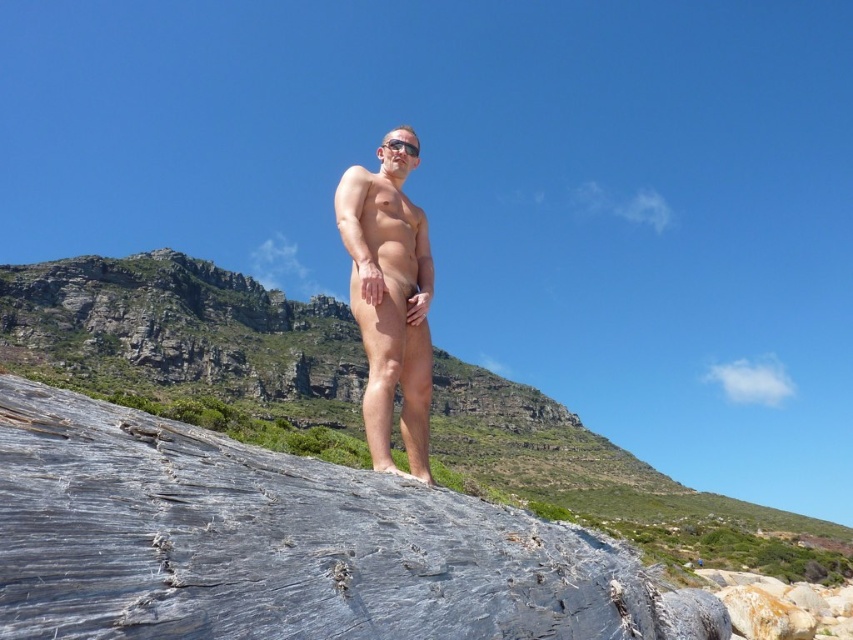
Question: Among these objects, which one is nearest to the camera?

Choices:
 (A) matte skin at center
 (B) gray rough rock at center

Answer: (A)

Question: Does gray rough rock at lower left come behind matte skin at center?

Choices:
 (A) no
 (B) yes

Answer: (A)

Question: Which object appears farthest from the camera in this image?

Choices:
 (A) gray rough rock at center
 (B) matte skin at center

Answer: (A)

Question: Is gray rough rock at center to the right of matte skin at center from the viewer's perspective?

Choices:
 (A) yes
 (B) no

Answer: (B)

Question: Does gray rough rock at lower left have a smaller size compared to gray rough rock at center?

Choices:
 (A) yes
 (B) no

Answer: (A)

Question: Among these objects, which one is farthest from the camera?

Choices:
 (A) gray rough rock at lower left
 (B) gray rough rock at center

Answer: (B)